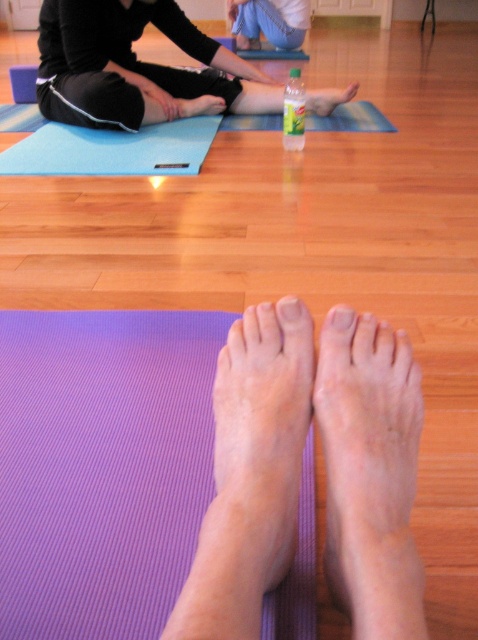
You are a photographer setting up for a yoga class photo shoot. You need to position a camera on a tripod in such a way that both the black matte leggings at upper center and the blue textured yoga mat at upper center are clearly visible in the frame. Based on their positions, which object should be placed closer to the camera to ensure both are visible without obstruction?

The black matte leggings at upper center should be placed closer to the camera since the blue textured yoga mat at upper center is behind it. This arrangement ensures that the leggings are not obscured by the mat, allowing both objects to be clearly visible in the photo.

You are a photographer setting up a shoot in this yoga studio. You need to place a 1.2 meter wide backdrop behind the black matte leggings at upper center and the blue textured yoga mat at upper center. Will the backdrop cover both objects completely?

The black matte leggings at upper center is wider than the blue textured yoga mat at upper center. Since the backdrop is 1.2 meters wide, it can cover both objects as long as their combined width does not exceed the backdrop width. However, without knowing the exact widths of the objects, we can only confirm that the backdrop is wider than either individual object.

You are a photographer setting up a shoot in the yoga studio. You need to position a tripod so it doesn not block the blue denim jeans at upper center or the clear plastic bottle at center. Given that the tripod requires 1 meter of space in front of it, where should you place the tripod to avoid both objects?

The blue denim jeans at upper center is located above the clear plastic bottle at center. To avoid both objects, position the tripod behind the clear plastic bottle at center, ensuring there is at least 1 meter of space in front of it. This placement keeps the tripod clear of both the upper jeans and the central bottle.